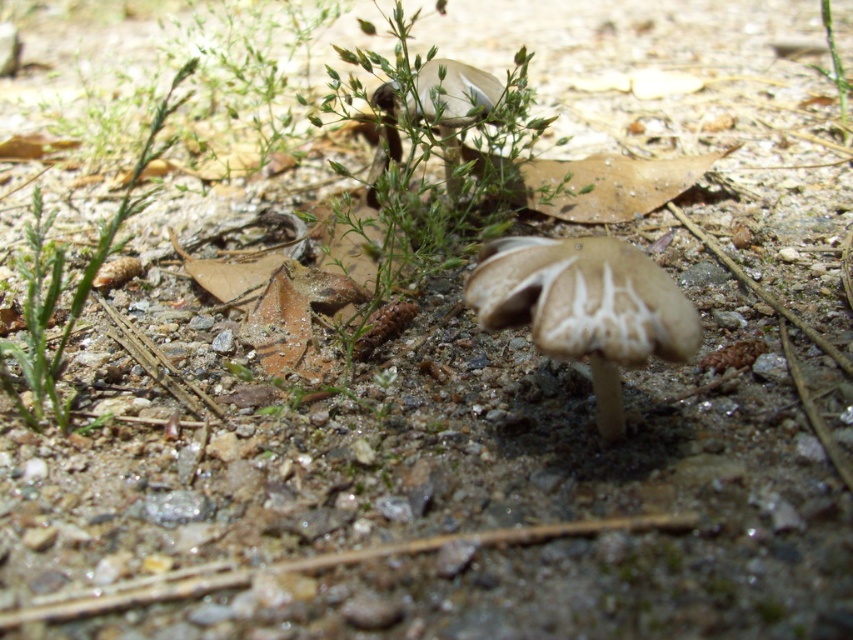
Question: Which of the following is the farthest from the observer?

Choices:
 (A) green leafy plant at left
 (B) brown matte mushroom at center

Answer: (A)

Question: Can you confirm if brown matte mushroom at center is bigger than green leafy plant at left?

Choices:
 (A) yes
 (B) no

Answer: (B)

Question: Is brown matte mushroom at center wider than green leafy plant at left?

Choices:
 (A) yes
 (B) no

Answer: (B)

Question: Which object is farther from the camera taking this photo?

Choices:
 (A) green leafy plant at left
 (B) brown matte mushroom at center

Answer: (A)

Question: Can you confirm if brown matte mushroom at center is smaller than green leafy plant at left?

Choices:
 (A) yes
 (B) no

Answer: (A)